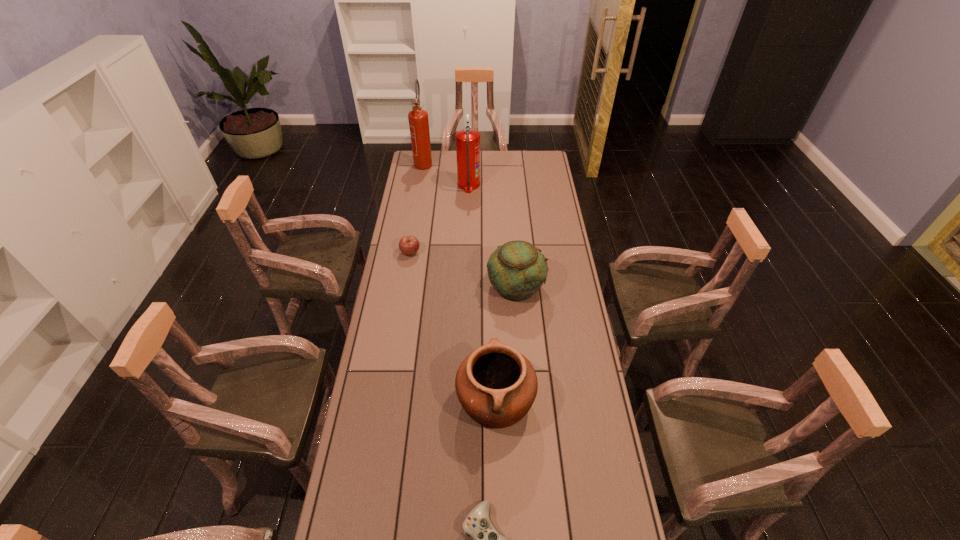
You are a GUI agent. You are given a task and a screenshot of the screen. Output one action in this format:
    pyautogui.click(x=<x>, y=<y>)
    Task: Click on the object that stands as the fifth closest to the control
    Image resolution: width=960 pixels, height=540 pixels.
    Given the screenshot: What is the action you would take?
    pyautogui.click(x=418, y=118)

Select which object is the closest to the nearest object. Please provide its 2D coordinates. Your answer should be formatted as a tuple, i.e. [(x, y)], where the tuple contains the x and y coordinates of a point satisfying the conditions above.

[(496, 385)]

The image size is (960, 540). In order to click on vacant region that satisfies the following two spatial constraints: 1. on the instruction side of the fifth nearest object; 2. on the right side of the fourth farthest object in this screenshot , I will do `click(466, 286)`.

The width and height of the screenshot is (960, 540). In order to click on free space that satisfies the following two spatial constraints: 1. on the instruction side of the nearer fire extinguisher; 2. on the side of the second shortest object with the unique marking in this screenshot , I will do `click(467, 253)`.

Identify the location of vacant space that satisfies the following two spatial constraints: 1. on the instruction side of the nearer fire extinguisher; 2. on the side of the apple with the unique marking. This screenshot has height=540, width=960. (467, 253).